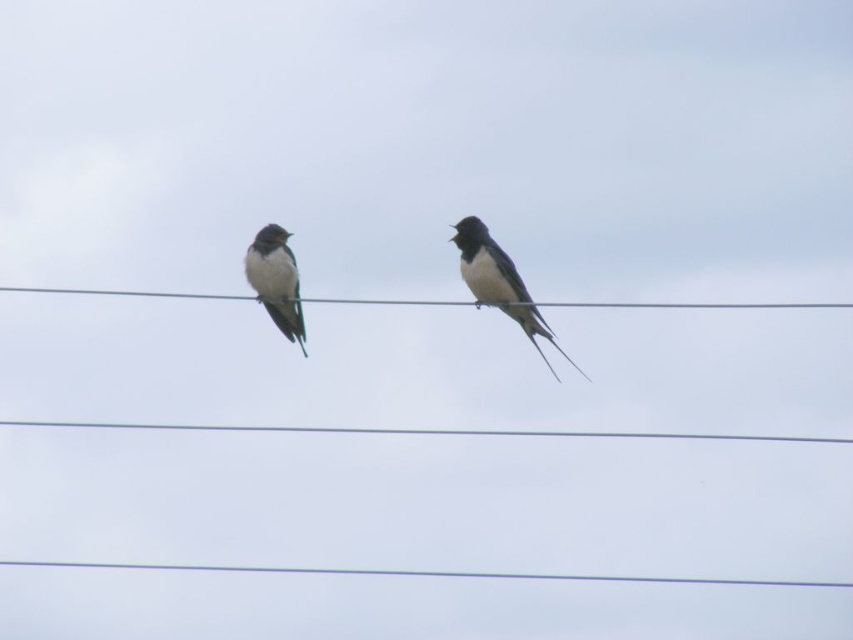
In the scene shown: Is metallic wire at center shorter than white matte bird at left?

Correct, metallic wire at center is not as tall as white matte bird at left.

Who is higher up, metallic wire at center or white matte bird at left?

metallic wire at center is higher up.

Find the location of a particular element. This screenshot has width=853, height=640. metallic wire at center is located at coordinates (695, 305).

Find the location of `metallic wire at center`. metallic wire at center is located at coordinates (695, 305).

Can you confirm if black glossy swallow at center is smaller than metallic wire at center?

No.

Image resolution: width=853 pixels, height=640 pixels. What do you see at coordinates (498, 282) in the screenshot? I see `black glossy swallow at center` at bounding box center [498, 282].

Measure the distance between black glossy swallow at center and camera.

black glossy swallow at center and camera are 28.16 feet apart.

The width and height of the screenshot is (853, 640). I want to click on black glossy swallow at center, so click(x=498, y=282).

Does black glossy swallow at center have a greater width compared to white matte bird at left?

Correct, the width of black glossy swallow at center exceeds that of white matte bird at left.

The height and width of the screenshot is (640, 853). Describe the element at coordinates (498, 282) in the screenshot. I see `black glossy swallow at center` at that location.

What do you see at coordinates (498, 282) in the screenshot? This screenshot has width=853, height=640. I see `black glossy swallow at center` at bounding box center [498, 282].

Image resolution: width=853 pixels, height=640 pixels. Find the location of `black glossy swallow at center`. black glossy swallow at center is located at coordinates (498, 282).